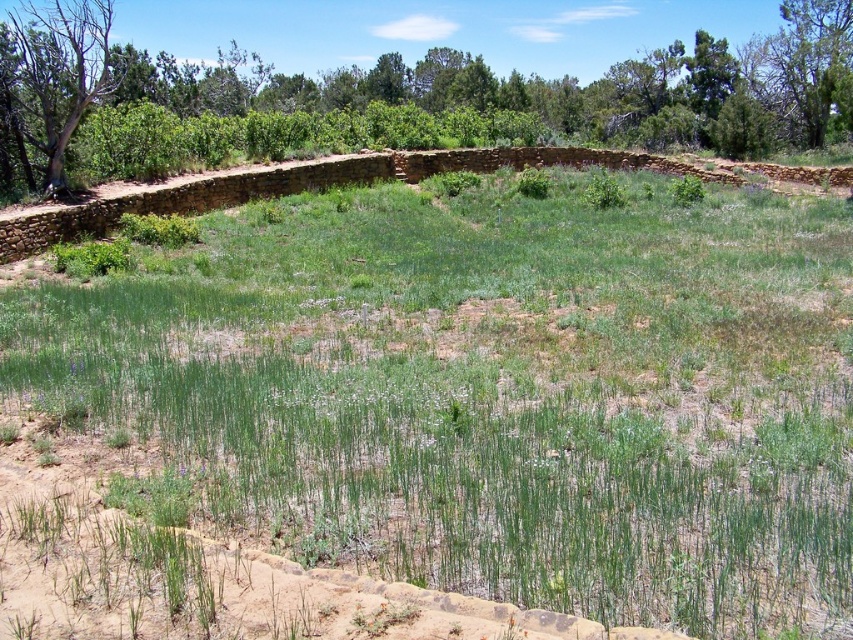
You are an environmental scientist assessing the biodiversity of this historical site. You observe the green leafy tree at upper left and the brown bark tree at upper left. Which tree has a larger canopy spread? Please base your answer on the visible characteristics in the image.

The green leafy tree at upper left has a larger canopy spread than the brown bark tree at upper left, as its width surpasses the latter.

You are standing at the edge of the grassy area and want to reach the green leafy tree at upper left. The green grassy at center is in your path. Can you walk directly to the tree without stepping on the grass?

The green grassy at center is 77.43 feet away from the green leafy tree at upper left. Since the grass is in the center, you can walk around it to reach the tree without stepping on the grass.

You are standing at the center of the grassy area enclosed by the stone wall and looking towards the upper part of the image. You notice two trees in the background. Which tree, the brown bark tree at upper left or the green leafy tree at upper right, is closer to you?

The brown bark tree at upper left is positioned under the green leafy tree at upper right, meaning the brown bark tree at upper left is closer to you.